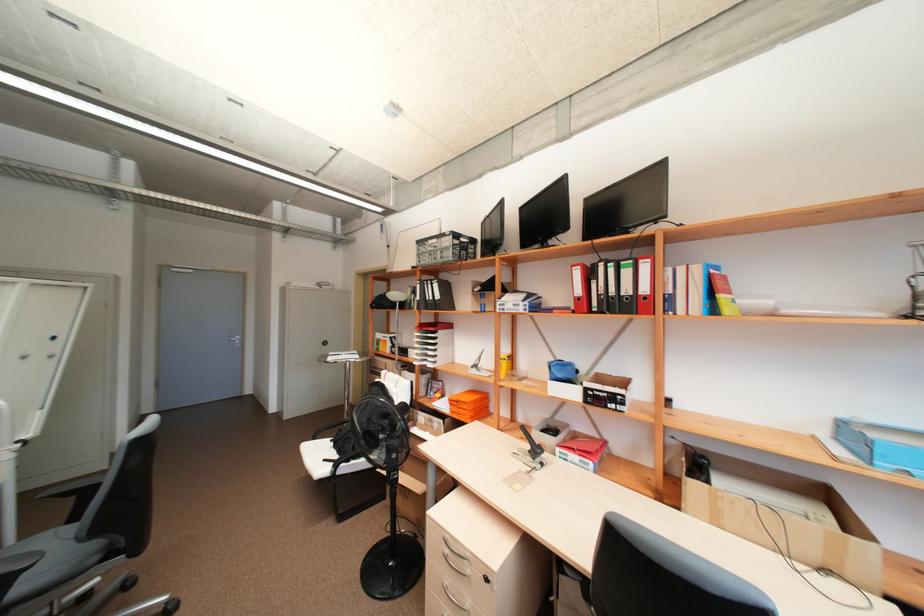
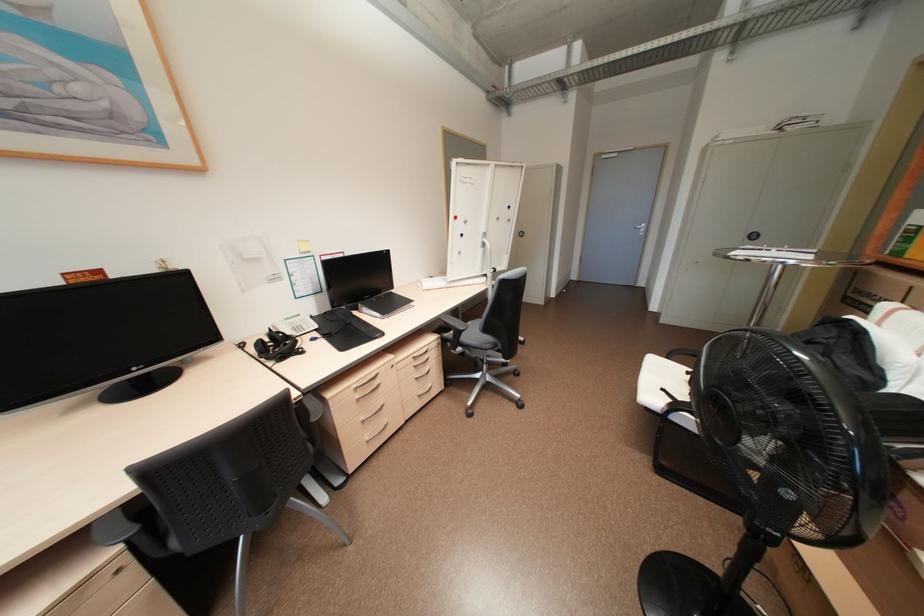
First-person continuous shooting, in which direction is the camera rotating?

The camera's rotation is toward left-down.